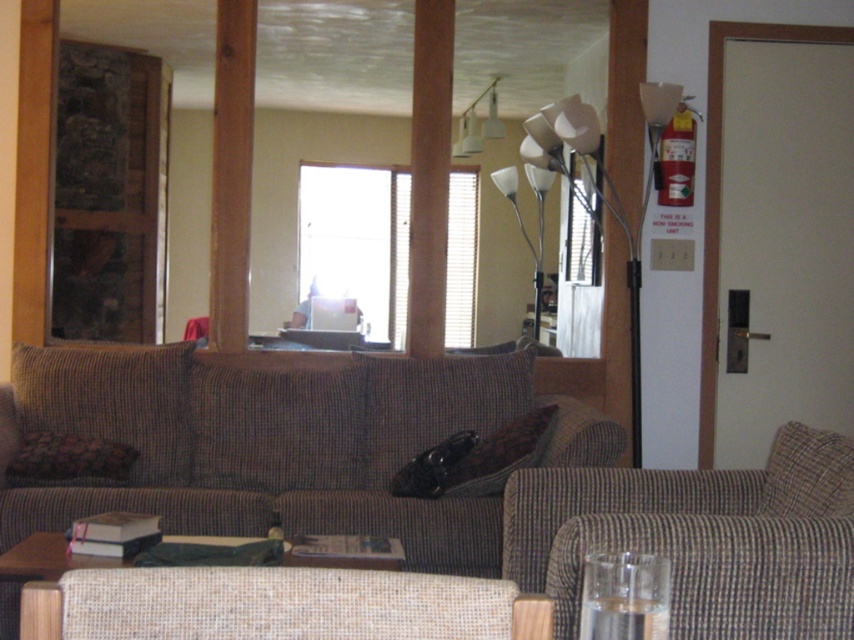
Question: Can you confirm if brown textured pillow at center is positioned to the left of white matte lamp at upper center?

Choices:
 (A) yes
 (B) no

Answer: (B)

Question: Estimate the real-world distances between objects in this image. Which object is farther from the brown textured pillow at center?

Choices:
 (A) white matte lamp at upper center
 (B) floral fabric pillow at center
 (C) beige woven table at lower center

Answer: (A)

Question: Is brown textured pillow at right bigger than floral fabric pillow at center?

Choices:
 (A) yes
 (B) no

Answer: (A)

Question: Is the position of beige woven table at lower center less distant than that of floral fabric pillow at center?

Choices:
 (A) no
 (B) yes

Answer: (B)

Question: Among these objects, which one is farthest from the camera?

Choices:
 (A) brown textured pillow at center
 (B) white glossy floor lamp at center
 (C) beige woven table at lower center
 (D) brown checkered couch at lower right

Answer: (B)

Question: Which object is the farthest from the floral fabric pillow at center?

Choices:
 (A) white glossy floor lamp at center
 (B) beige woven table at lower center
 (C) brown textured pillow at center

Answer: (A)